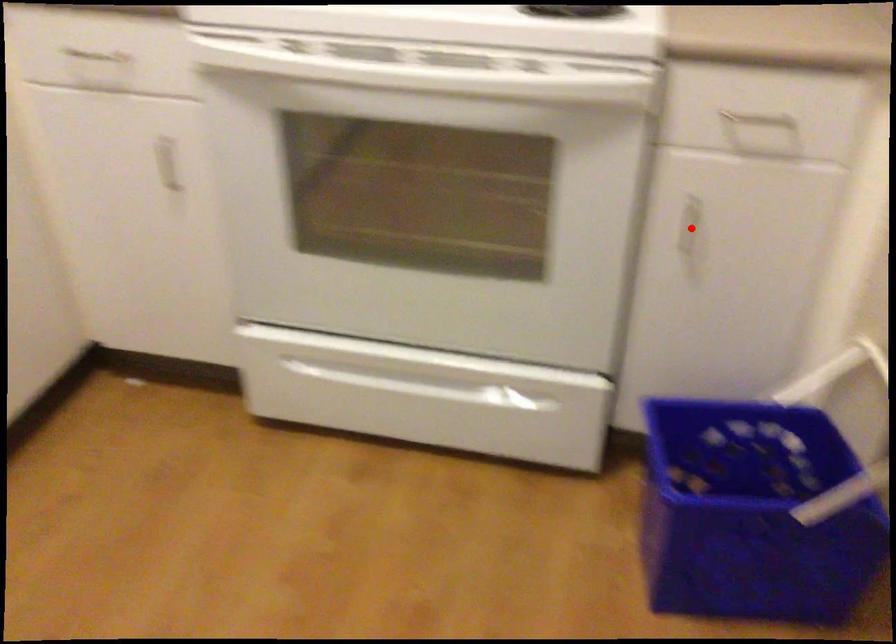
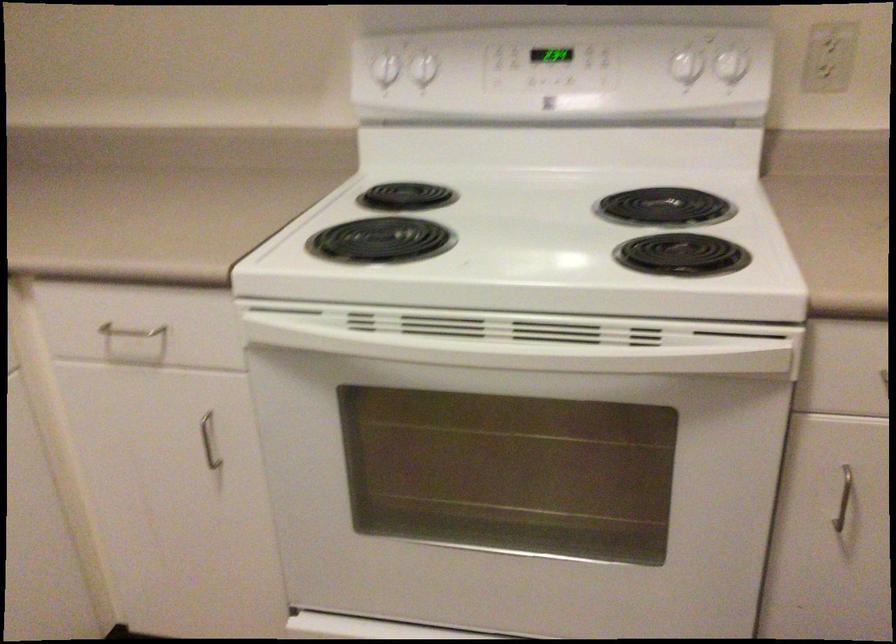
Question: I am providing you with two images of the same scene from different viewpoints. In image1, a red point is highlighted. Considering the same 3D point in image2, which of the following is correct?

Choices:
 (A) It is closer
 (B) It is farther

Answer: (A)